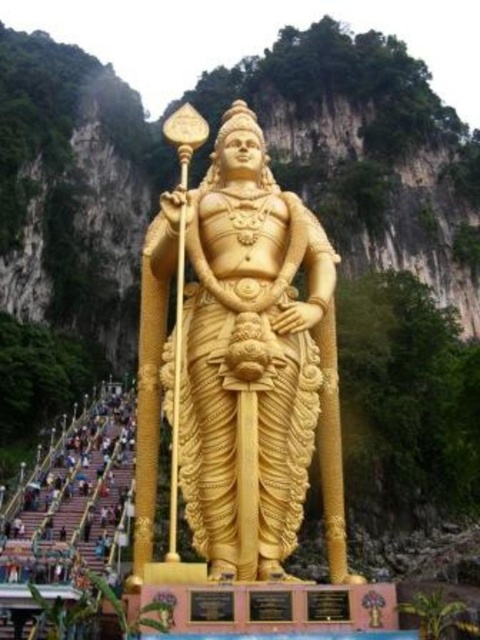
Does point (286, 556) come closer to viewer compared to point (2, 568)?

Yes.

Who is more forward, (145, 417) or (124, 500)?

Point (145, 417) is in front.

Image resolution: width=480 pixels, height=640 pixels. I want to click on gold polished statue at center, so click(240, 365).